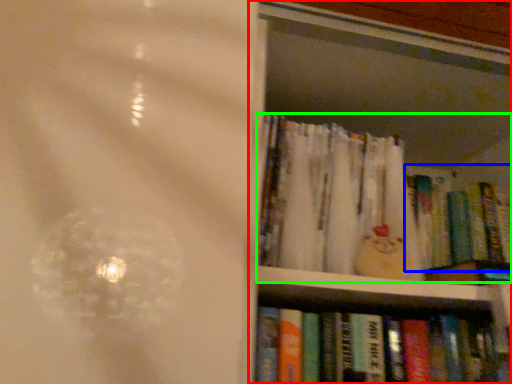
Question: Which is farther away from bookcase (highlighted by a red box)? book (highlighted by a blue box) or book (highlighted by a green box)?

Choices:
 (A) book
 (B) book

Answer: (A)